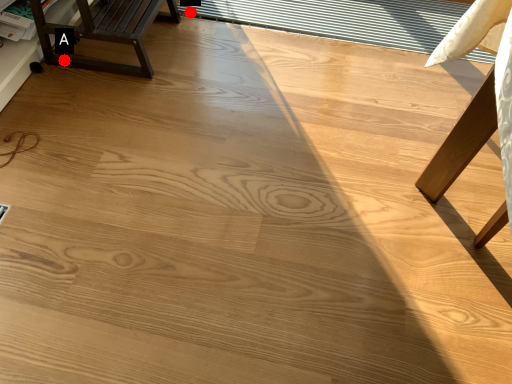
Question: Two points are circled on the image, labeled by A and B beside each circle. Among these points, which one is nearest to the camera?

Choices:
 (A) A is closer
 (B) B is closer

Answer: (A)